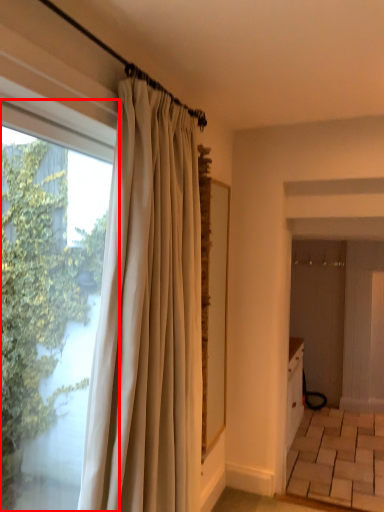
Question: In this image, where is window (annotated by the red box) located relative to curtain?

Choices:
 (A) left
 (B) right

Answer: (A)